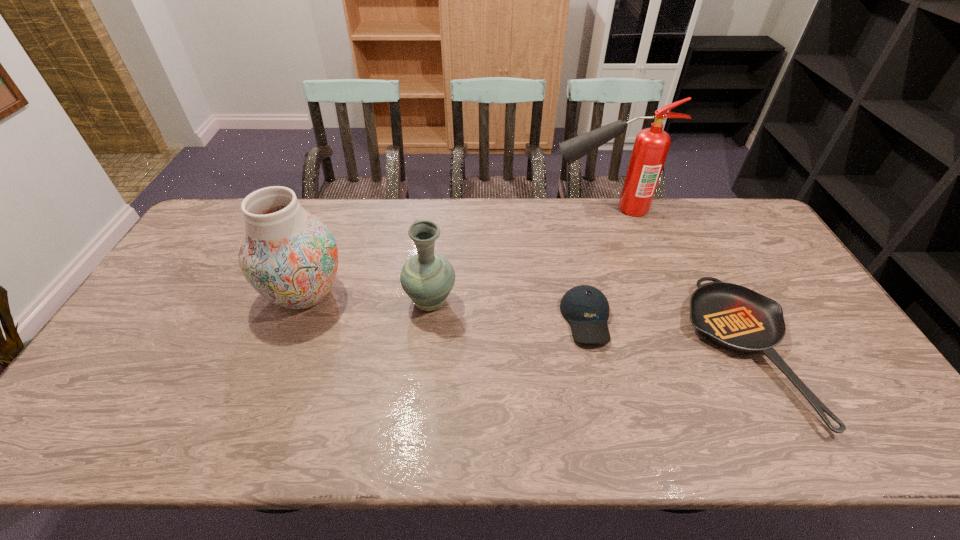
This screenshot has width=960, height=540. Identify the location of vacant area between the shortest object and the second shortest object. (666, 335).

Locate an element on the screen. The height and width of the screenshot is (540, 960). empty space between the pitcher and the vase is located at coordinates (368, 298).

At what (x,y) coordinates should I click in order to perform the action: click on vacant point located between the farthest object and the frying pan. Please return your answer as a coordinate pair (x, y). Looking at the image, I should click on (675, 280).

Find the location of a particular element. This screenshot has width=960, height=540. free space between the leftmost object and the tallest object is located at coordinates (455, 251).

Find the location of a particular element. This screenshot has width=960, height=540. vacant region between the fourth tallest object and the frying pan is located at coordinates (666, 335).

This screenshot has width=960, height=540. In order to click on the third closest object to the tallest object in this screenshot , I will do `click(427, 277)`.

Where is `object that is the second closest one to the fourth tallest object`? object that is the second closest one to the fourth tallest object is located at coordinates (427, 277).

Locate an element on the screen. The image size is (960, 540). free point that satisfies the following two spatial constraints: 1. at the nozzle of the tallest object; 2. on the front side of the vase is located at coordinates (634, 294).

Where is `free spot that satisfies the following two spatial constraints: 1. at the nozzle of the fire extinguisher; 2. on the front-facing side of the second shortest object`? free spot that satisfies the following two spatial constraints: 1. at the nozzle of the fire extinguisher; 2. on the front-facing side of the second shortest object is located at coordinates (642, 319).

This screenshot has height=540, width=960. I want to click on blank space that satisfies the following two spatial constraints: 1. on the front-facing side of the baseball cap; 2. on the left side of the frying pan, so click(x=593, y=352).